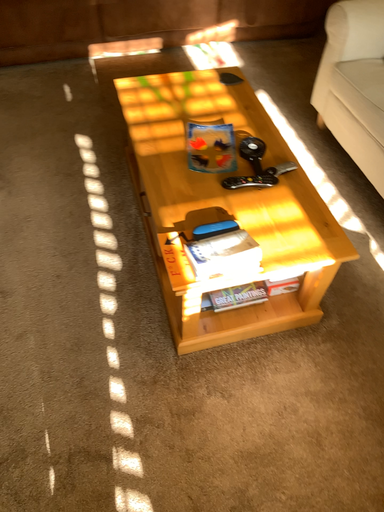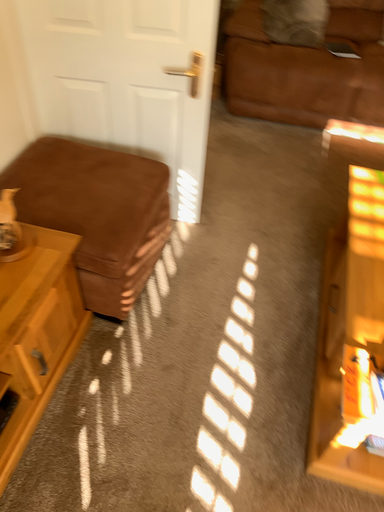
Question: How did the camera likely rotate when shooting the video?

Choices:
 (A) rotated left
 (B) rotated right

Answer: (A)